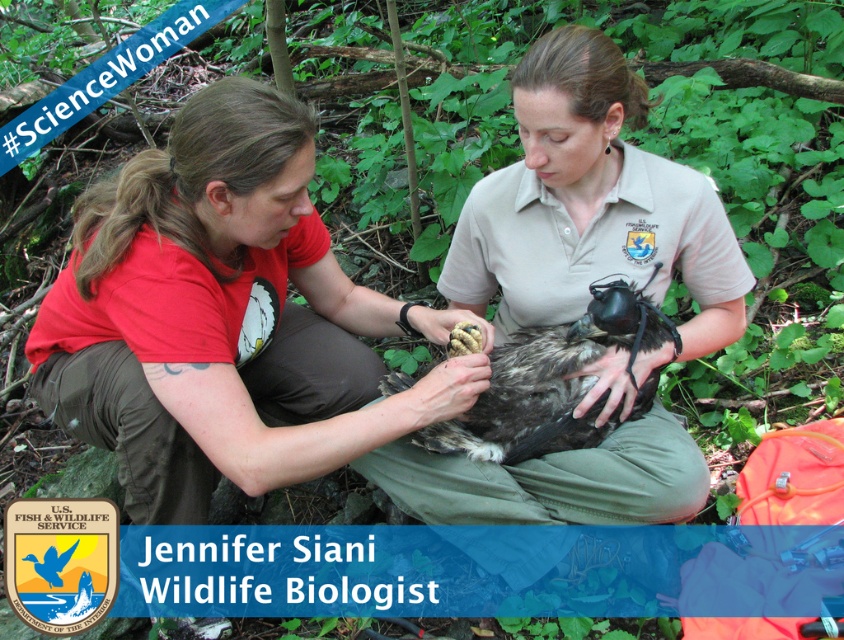
Question: Which point is closer to the camera taking this photo?

Choices:
 (A) (507, 480)
 (B) (214, 340)
 (C) (502, 449)

Answer: (B)

Question: Which is nearer to the matte khaki shirt at center?

Choices:
 (A) dark brown feathered eagle at center
 (B) matte red shirt at center

Answer: (A)

Question: Is matte red shirt at center to the right of matte khaki shirt at center from the viewer's perspective?

Choices:
 (A) no
 (B) yes

Answer: (A)

Question: From the image, what is the correct spatial relationship of matte red shirt at center in relation to matte khaki shirt at center?

Choices:
 (A) above
 (B) below

Answer: (B)

Question: Which point appears farthest from the camera in this image?

Choices:
 (A) click(x=699, y=492)
 (B) click(x=366, y=362)
 (C) click(x=515, y=360)

Answer: (B)

Question: Is matte khaki shirt at center further to camera compared to dark brown feathered eagle at center?

Choices:
 (A) yes
 (B) no

Answer: (B)